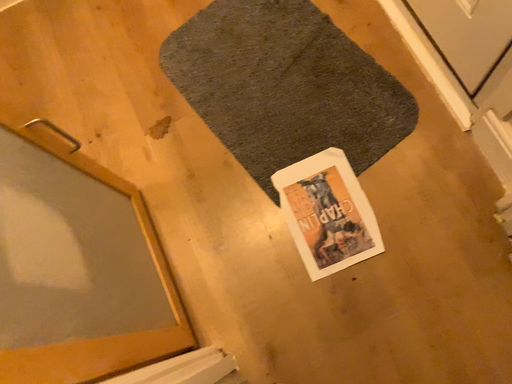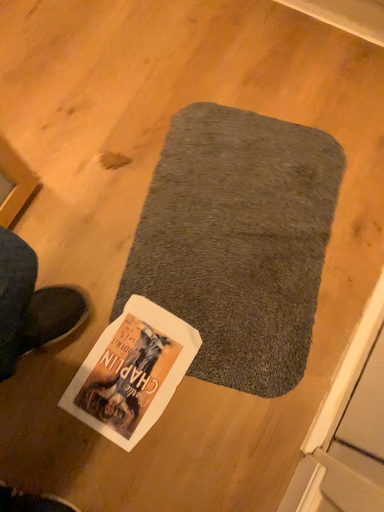
Question: How did the camera likely rotate when shooting the video?

Choices:
 (A) rotated left
 (B) rotated right

Answer: (A)